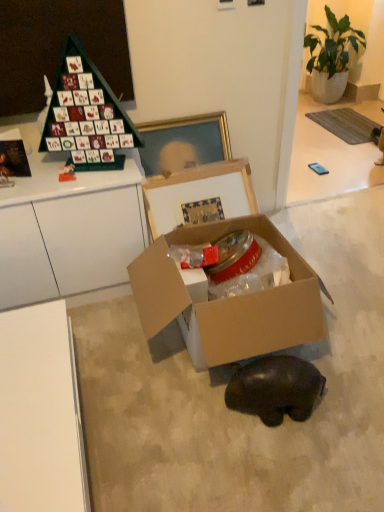
The height and width of the screenshot is (512, 384). What do you see at coordinates (228, 300) in the screenshot? I see `cardboard box at center` at bounding box center [228, 300].

I want to click on green matte advent calendar at upper left, so click(x=86, y=113).

Measure the distance between point (311,49) and camera.

Point (311,49) and camera are 3.91 meters apart from each other.

In order to face green leafy plant in pot at upper right, should I rotate leftwards or rightwards?

Rotate your view right by about 17.235°.

You are a GUI agent. You are given a task and a screenshot of the screen. Output one action in this format:
    pyautogui.click(x=<x>, y=<y>)
    Task: Click on the cardboard box at center
    
    Given the screenshot: What is the action you would take?
    pyautogui.click(x=228, y=300)

In terms of height, does green leafy plant in pot at upper right look taller or shorter compared to black matte bear at lower center?

green leafy plant in pot at upper right is taller than black matte bear at lower center.

Is green leafy plant in pot at upper right not near black matte bear at lower center?

That's right, there is a large distance between green leafy plant in pot at upper right and black matte bear at lower center.

Considering the positions of objects green leafy plant in pot at upper right and black matte bear at lower center in the image provided, who is more to the left, green leafy plant in pot at upper right or black matte bear at lower center?

black matte bear at lower center.

From the image's perspective, is green leafy plant in pot at upper right above or below black matte bear at lower center?

green leafy plant in pot at upper right is situated higher than black matte bear at lower center in the image.

Considering the relative sizes of green leafy plant in pot at upper right and green matte advent calendar at upper left in the image provided, is green leafy plant in pot at upper right thinner than green matte advent calendar at upper left?

In fact, green leafy plant in pot at upper right might be wider than green matte advent calendar at upper left.

Could you measure the distance between green leafy plant in pot at upper right and green matte advent calendar at upper left?

9.57 feet.

Is green leafy plant in pot at upper right facing away from green matte advent calendar at upper left?

That's not correct — green leafy plant in pot at upper right is not looking away from green matte advent calendar at upper left.

How distant is green matte advent calendar at upper left from black matte bear at lower center?

A distance of 3.54 feet exists between green matte advent calendar at upper left and black matte bear at lower center.

Are green matte advent calendar at upper left and black matte bear at lower center far apart?

green matte advent calendar at upper left is far away from black matte bear at lower center.

Consider the image. Which object is more forward, green matte advent calendar at upper left or black matte bear at lower center?

black matte bear at lower center is more forward.

Is green matte advent calendar at upper left bigger or smaller than black matte bear at lower center?

green matte advent calendar at upper left is bigger than black matte bear at lower center.

Based on the photo, from their relative heights in the image, would you say green leafy plant in pot at upper right is taller or shorter than cardboard box at center?

green leafy plant in pot at upper right is taller than cardboard box at center.

Which is more to the left, green leafy plant in pot at upper right or cardboard box at center?

cardboard box at center is more to the left.

Is green leafy plant in pot at upper right positioned in front of cardboard box at center?

No.

Is green leafy plant in pot at upper right inside the boundaries of cardboard box at center, or outside?

green leafy plant in pot at upper right is not inside cardboard box at center, it's outside.

Where is `toy above the black matte bear at lower center (from the image's perspective)`? Image resolution: width=384 pixels, height=512 pixels. toy above the black matte bear at lower center (from the image's perspective) is located at coordinates (86, 113).

Is point (262, 376) positioned in front of point (106, 104)?

Yes, it is.

Based on the photo, is black matte bear at lower center oriented towards green matte advent calendar at upper left?

No, black matte bear at lower center is not facing towards green matte advent calendar at upper left.

From the image's perspective, is black matte bear at lower center located beneath green matte advent calendar at upper left?

Indeed, from the image's perspective, black matte bear at lower center is shown beneath green matte advent calendar at upper left.

Does green matte advent calendar at upper left have a greater width compared to green leafy plant in pot at upper right?

No, green matte advent calendar at upper left is not wider than green leafy plant in pot at upper right.

There is a green leafy plant in pot at upper right. Where is `toy above it (from a real-world perspective)`? toy above it (from a real-world perspective) is located at coordinates (86, 113).

Does green matte advent calendar at upper left come in front of green leafy plant in pot at upper right?

Yes, green matte advent calendar at upper left is closer to the viewer.

Consider the image. Would you say green matte advent calendar at upper left is inside or outside green leafy plant in pot at upper right?

green matte advent calendar at upper left is not enclosed by green leafy plant in pot at upper right.

Which of these two, green matte advent calendar at upper left or cardboard box at center, is thinner?

green matte advent calendar at upper left.

Is green matte advent calendar at upper left to the left or to the right of cardboard box at center in the image?

Based on their positions, green matte advent calendar at upper left is located to the left of cardboard box at center.

Consider the image. From a real-world perspective, does green matte advent calendar at upper left stand above cardboard box at center?

Indeed, from a real-world perspective, green matte advent calendar at upper left stands above cardboard box at center.

Is green matte advent calendar at upper left positioned with its back to cardboard box at center?

That's not correct — green matte advent calendar at upper left is not looking away from cardboard box at center.

Identify the location of animal on the left of green leafy plant in pot at upper right. (275, 389).

Locate an element on the screen. toy above the green leafy plant in pot at upper right (from a real-world perspective) is located at coordinates (86, 113).

Considering their positions, is green leafy plant in pot at upper right positioned closer to green matte advent calendar at upper left than black matte bear at lower center?

Based on the image, black matte bear at lower center appears to be nearer to green matte advent calendar at upper left.

From the image, which object appears to be nearer to black matte bear at lower center, green matte advent calendar at upper left or green leafy plant in pot at upper right?

The object closer to black matte bear at lower center is green matte advent calendar at upper left.

Considering their positions, is green leafy plant in pot at upper right positioned closer to black matte bear at lower center than cardboard box at center?

Among the two, cardboard box at center is located nearer to black matte bear at lower center.

Looking at the image, which one is located closer to cardboard box at center, green matte advent calendar at upper left or black matte bear at lower center?

black matte bear at lower center is closer to cardboard box at center.

In the scene shown: Estimate the real-world distances between objects in this image. Which object is closer to green matte advent calendar at upper left, black matte bear at lower center or cardboard box at center?

Among the two, cardboard box at center is located nearer to green matte advent calendar at upper left.

Considering their positions, is green leafy plant in pot at upper right positioned closer to black matte bear at lower center than green matte advent calendar at upper left?

Based on the image, green matte advent calendar at upper left appears to be nearer to black matte bear at lower center.

Considering their positions, is black matte bear at lower center positioned closer to green leafy plant in pot at upper right than green matte advent calendar at upper left?

Among the two, green matte advent calendar at upper left is located nearer to green leafy plant in pot at upper right.

Which object lies nearer to the anchor point green leafy plant in pot at upper right, black matte bear at lower center or cardboard box at center?

Based on the image, cardboard box at center appears to be nearer to green leafy plant in pot at upper right.

This screenshot has height=512, width=384. What are the coordinates of `box between green leafy plant in pot at upper right and black matte bear at lower center from top to bottom` in the screenshot? It's located at (228, 300).

This screenshot has height=512, width=384. I want to click on toy located between cardboard box at center and green leafy plant in pot at upper right in the depth direction, so click(x=86, y=113).

In order to click on toy positioned between black matte bear at lower center and green leafy plant in pot at upper right from near to far in this screenshot , I will do `click(86, 113)`.

Where is `box that lies between green matte advent calendar at upper left and black matte bear at lower center from top to bottom`? The image size is (384, 512). box that lies between green matte advent calendar at upper left and black matte bear at lower center from top to bottom is located at coordinates (228, 300).